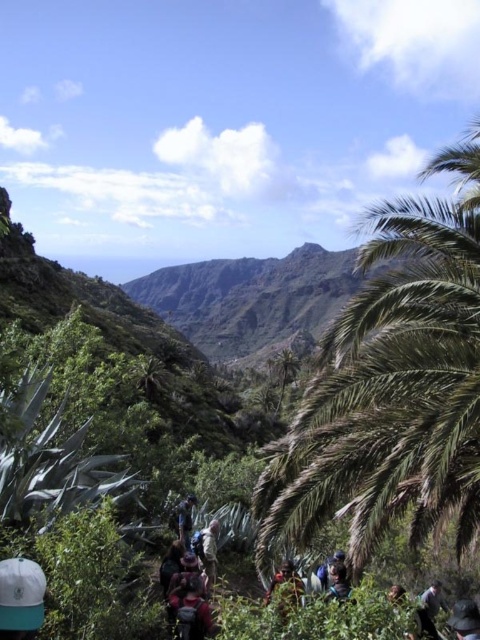
Looking at this image, is green leafy palm tree at center-right below reddish-brown fabric backpack at center?

No, green leafy palm tree at center-right is not below reddish-brown fabric backpack at center.

This screenshot has width=480, height=640. Describe the element at coordinates (393, 384) in the screenshot. I see `green leafy palm tree at center-right` at that location.

Identify the location of green leafy palm tree at center-right. The height and width of the screenshot is (640, 480). (393, 384).

Is green leafy palm tree at center-right smaller than red backpack at center?

Actually, green leafy palm tree at center-right might be larger than red backpack at center.

Describe the element at coordinates (393, 384) in the screenshot. The image size is (480, 640). I see `green leafy palm tree at center-right` at that location.

This screenshot has width=480, height=640. What do you see at coordinates (393, 384) in the screenshot?
I see `green leafy palm tree at center-right` at bounding box center [393, 384].

This screenshot has height=640, width=480. What are the coordinates of `green leafy palm tree at center-right` in the screenshot? It's located at (393, 384).

Can you confirm if dark blue fabric at center is taller than blue fabric backpack at center?

No.

Which is in front, point (213, 576) or point (176, 520)?

Positioned in front is point (213, 576).

Is point (199, 545) positioned after point (187, 548)?

Yes, point (199, 545) is behind point (187, 548).

I want to click on dark blue fabric at center, so click(x=206, y=550).